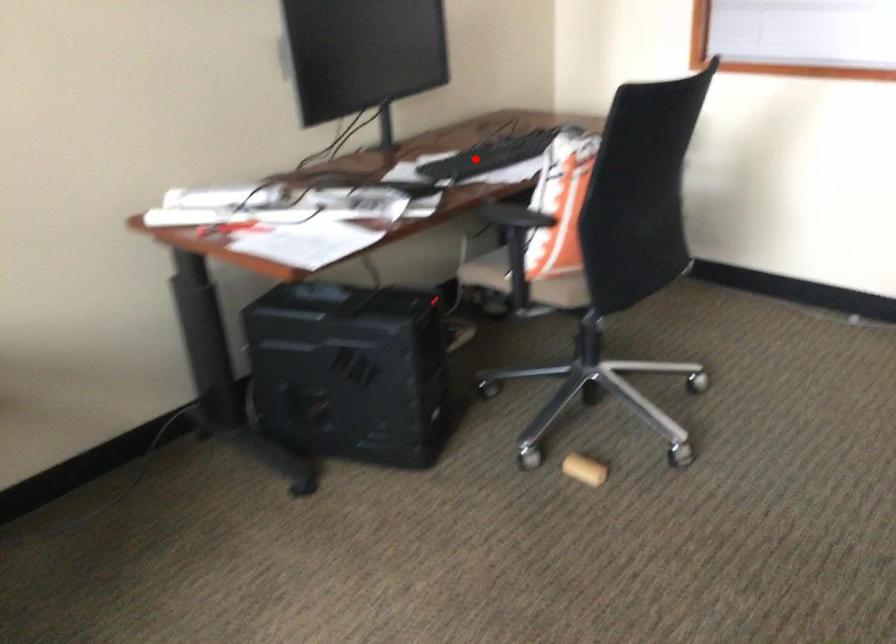
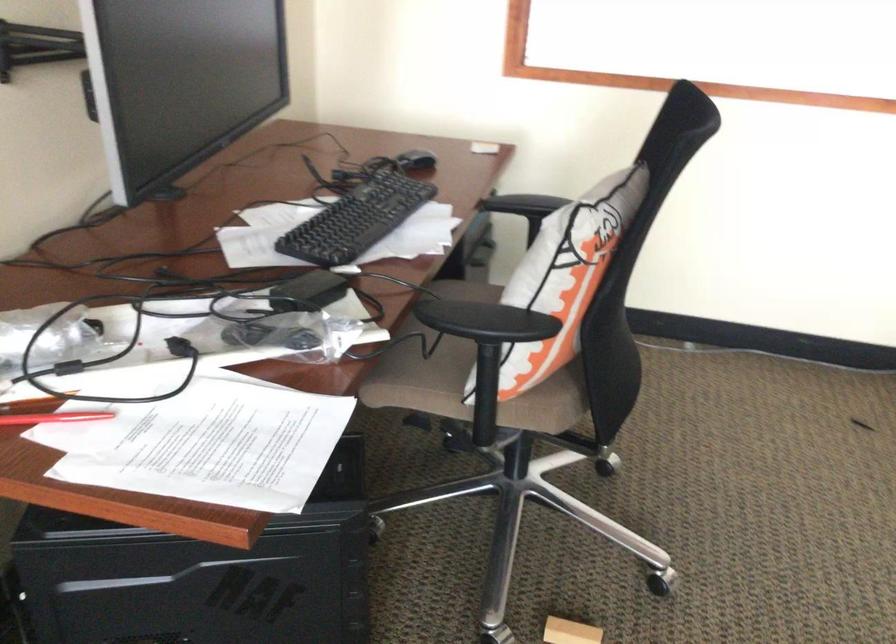
Question: I am providing you with two images of the same scene from different viewpoints. In image1, a red point is highlighted. Considering the same 3D point in image2, which of the following is correct?

Choices:
 (A) It is closer
 (B) It is farther

Answer: (A)